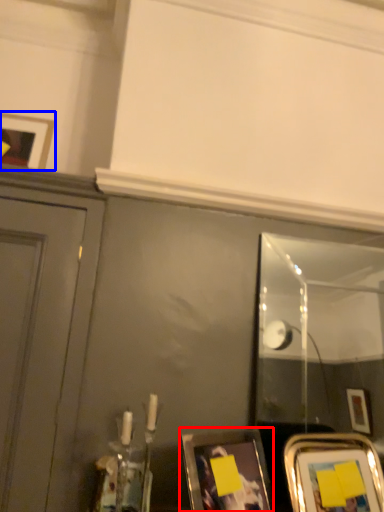
Question: Which of the following is the closest to the observer, picture frame (highlighted by a red box) or picture frame (highlighted by a blue box)?

Choices:
 (A) picture frame
 (B) picture frame

Answer: (A)